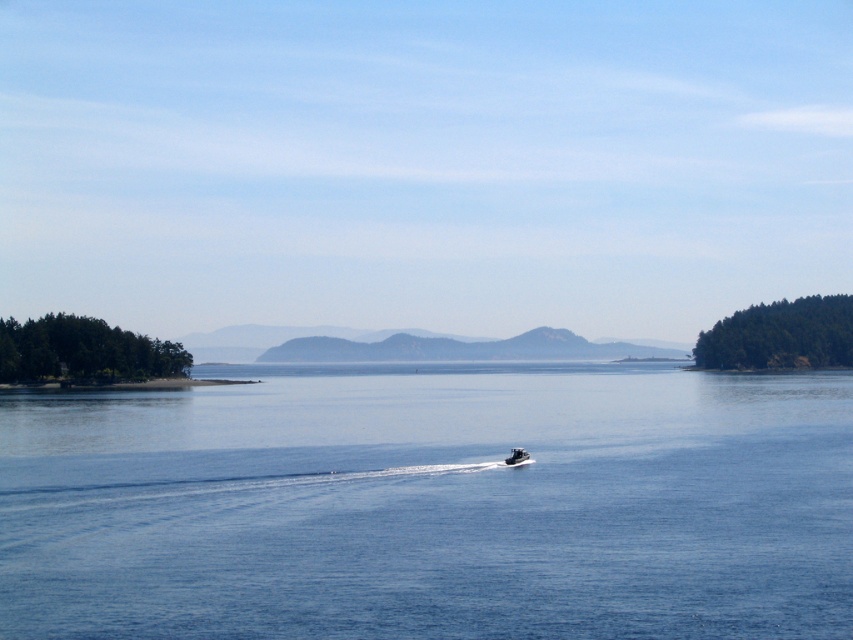
Question: Which point is farther to the camera?

Choices:
 (A) black plastic boat at center
 (B) blue water at center

Answer: (A)

Question: Can you confirm if blue water at center is thinner than black plastic boat at center?

Choices:
 (A) no
 (B) yes

Answer: (A)

Question: Is the position of blue water at center more distant than that of black plastic boat at center?

Choices:
 (A) yes
 (B) no

Answer: (B)

Question: Considering the relative positions of blue water at center and black plastic boat at center in the image provided, where is blue water at center located with respect to black plastic boat at center?

Choices:
 (A) below
 (B) above

Answer: (A)